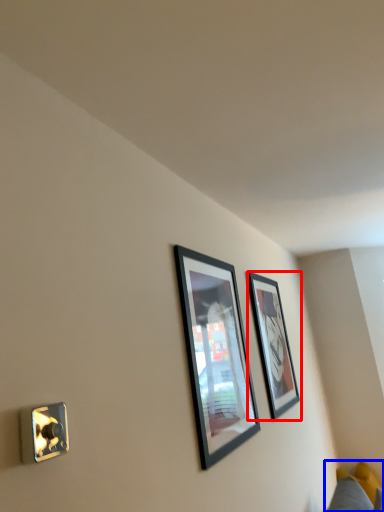
Question: Which point is further to the camera, picture frame (highlighted by a red box) or couch (highlighted by a blue box)?

Choices:
 (A) picture frame
 (B) couch

Answer: (B)